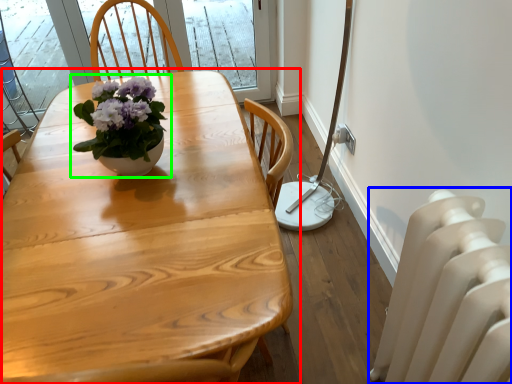
Question: Considering the real-world distances, which object is closest to table (highlighted by a red box)? radiator (highlighted by a blue box) or houseplant (highlighted by a green box).

Choices:
 (A) radiator
 (B) houseplant

Answer: (B)